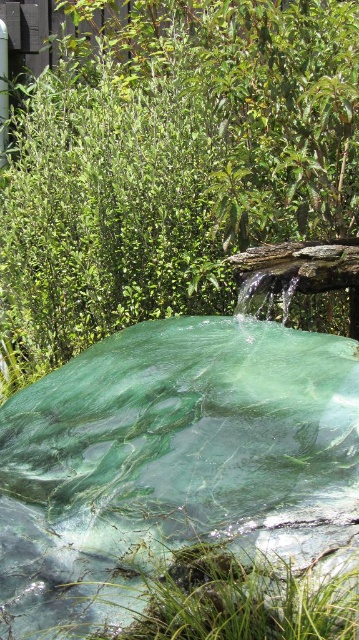
You are a gardener planning to place a small statue between the green marble water at center and the green leafy grass at lower center. Which object should you position the statue closer to if you want it to be closer to the wider area?

The green marble water at center might be wider than green leafy grass at lower center, so you should position the statue closer to the green marble water at center to be near the wider area.

You are a landscape architect designing a garden and want to place a new statue between the green leafy bush at upper center and the green marble water at center. Which object should the statue be placed closer to if you want it to be more visible from the main pathway that approaches from the lower part of the scene?

The statue should be placed closer to the green marble water at center because it is smaller in size than the green leafy bush at upper center, making it less obstructed and more visible from the lower pathway.

What are the coordinates of the green marble water at center in the image?

The green marble water at center is located at point (171, 461).